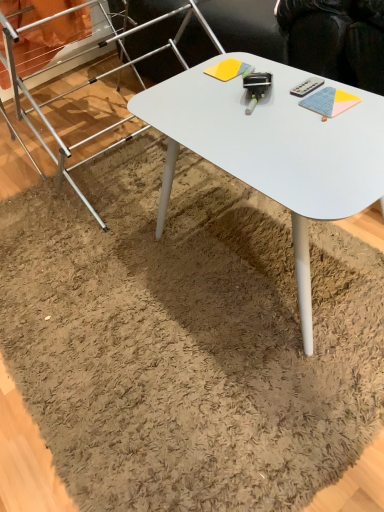
Identify the location of vacant space behind textured blue notepad at upper right, marked as the 2th notepad in a left-to-right arrangement. The image size is (384, 512). (291, 84).